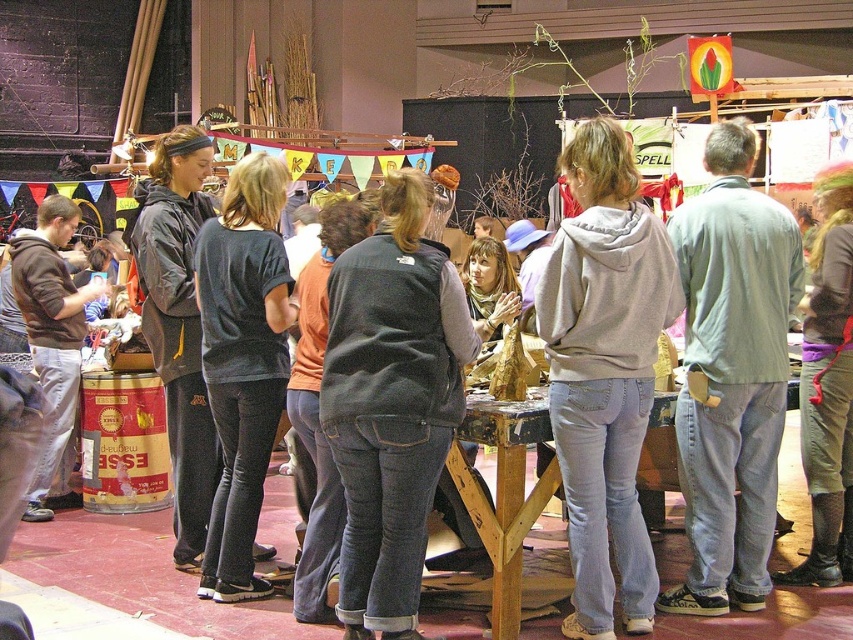
You are standing in the middle of the room and see both the light gray shirt at center and the dark gray sweater at center. Which one is closer to your eye level?

The light gray shirt at center is located above the dark gray sweater at center, so it is closer to your eye level.

You are standing at the back of the room and want to see the light gray hoodie at center. Is the brown hoodie at left blocking your view of it?

The light gray hoodie at center is located below the brown hoodie at left, so the brown hoodie at left is blocking the view of the light gray hoodie at center.